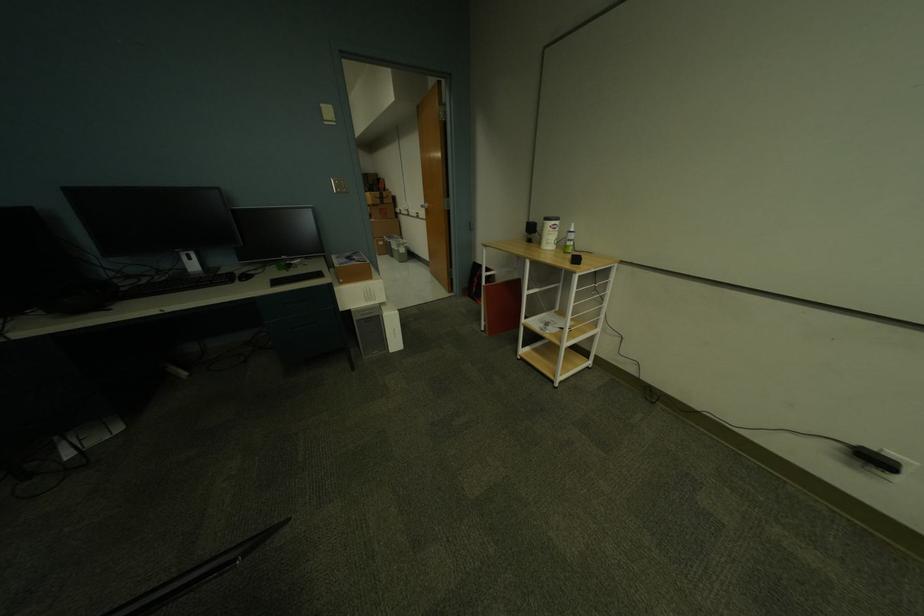
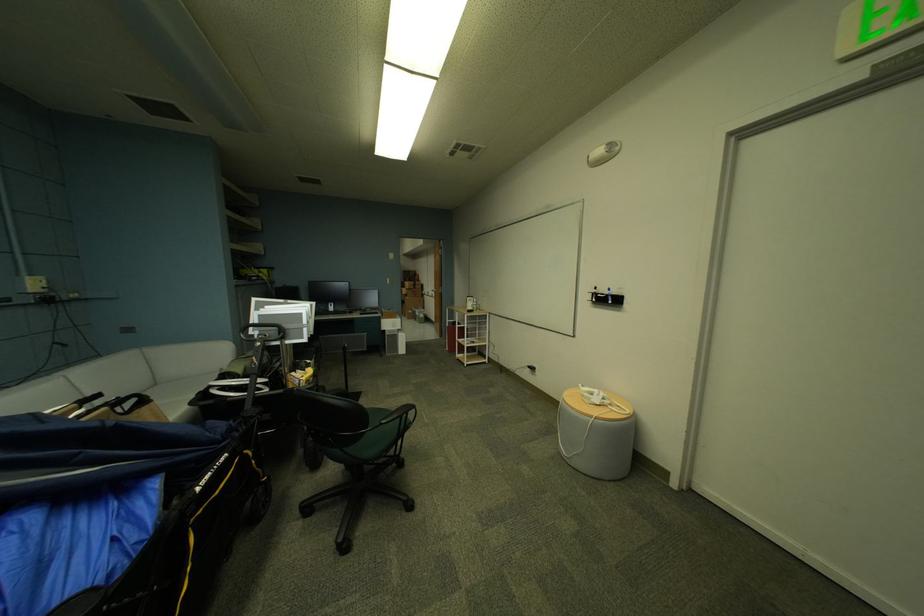
The point at (458, 291) is marked in the first image. Where is the corresponding point in the second image?

(450, 337)